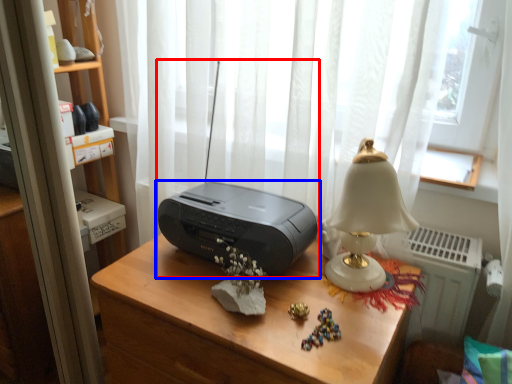
Question: Which object is further to the camera taking this photo, stereo (highlighted by a red box) or printer (highlighted by a blue box)?

Choices:
 (A) stereo
 (B) printer

Answer: (B)